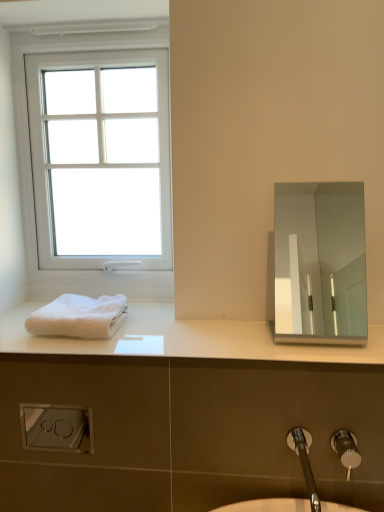
This screenshot has height=512, width=384. What are the coordinates of `vacant area that lies in front of white fluffy towel at lower left` in the screenshot? It's located at (69, 349).